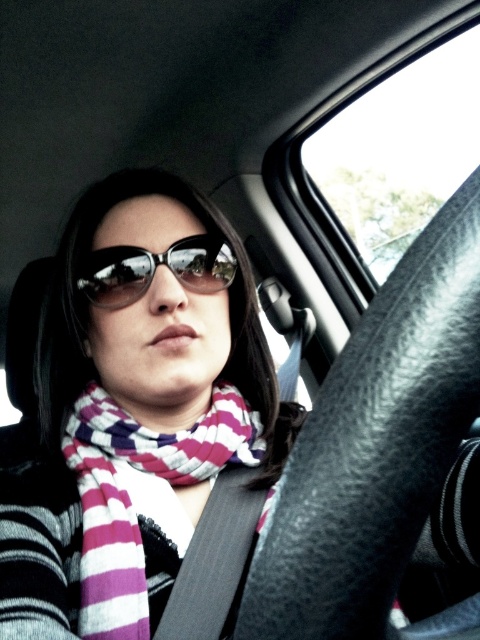
Based on the scene, can you determine if the purple striped scarf at center is wider than the black reflective sunglasses at center?

The purple striped scarf at center might be wider than black reflective sunglasses at center according to the description.

You are a fashion designer observing the person in the car. You need to determine which item, the striped scarf at center or the black reflective sunglasses at center, has a greater vertical height in the image. Which one is taller?

The striped scarf at center is taller than the black reflective sunglasses at center according to the description.